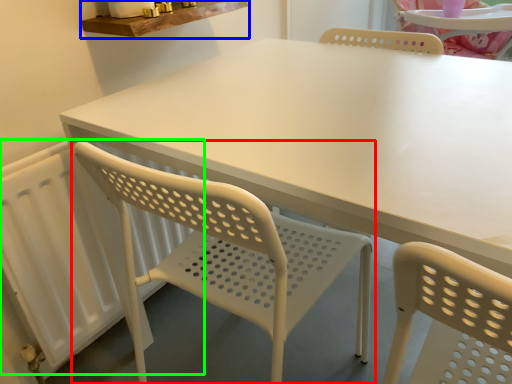
Question: Based on their relative distances, which object is nearer to chair (highlighted by a red box)? Choose from counter top (highlighted by a blue box) and radiator (highlighted by a green box).

Choices:
 (A) counter top
 (B) radiator

Answer: (B)